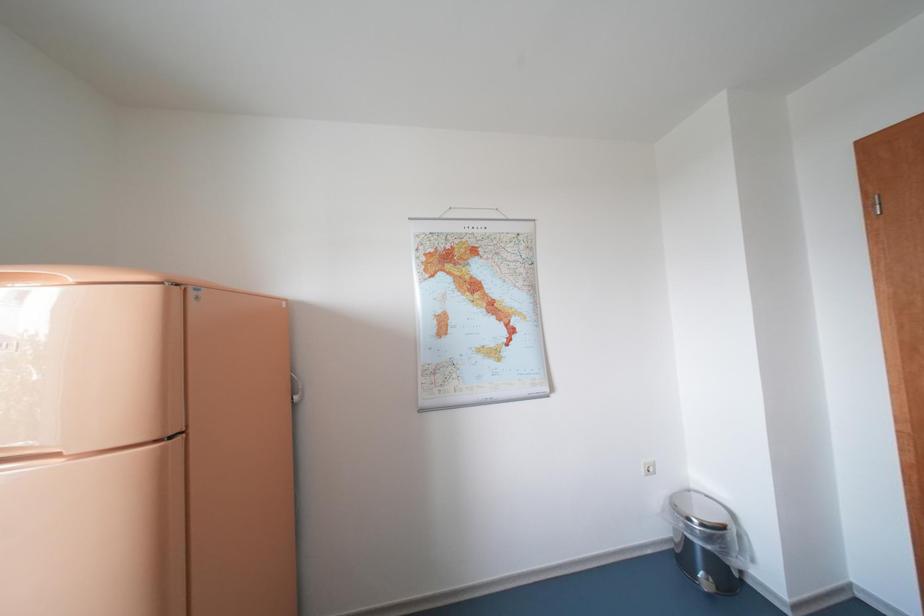
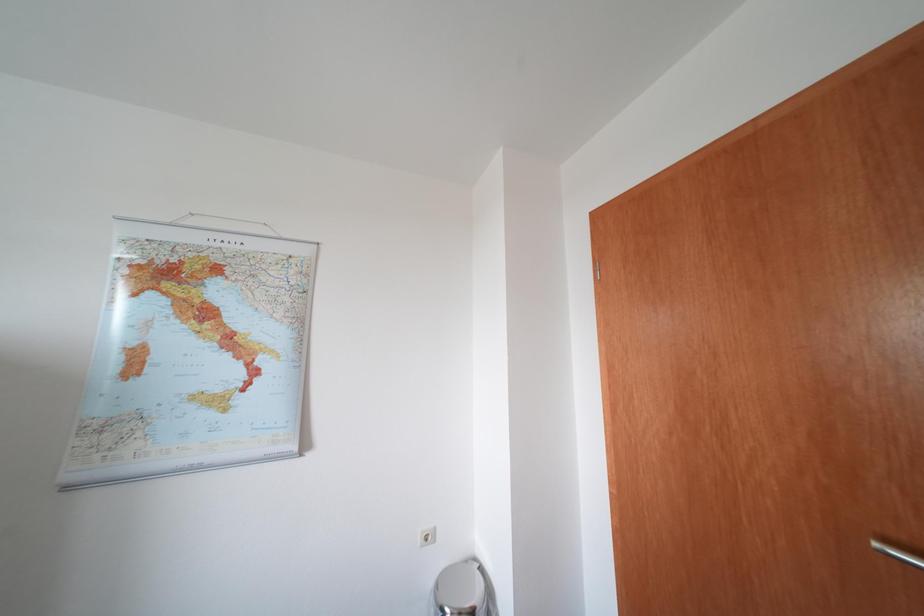
Question: The camera is either moving clockwise (left) or counter-clockwise (right) around the object. The first image is from the beginning of the video and the second image is from the end. Is the camera moving left or right when shooting the video?

Choices:
 (A) Left
 (B) Right

Answer: (A)